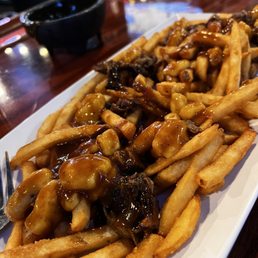
At what (x,y) coordinates should I click in order to perform the action: click on wall. Please return your answer as a coordinate pair (x, y). Looking at the image, I should click on (47, 239).